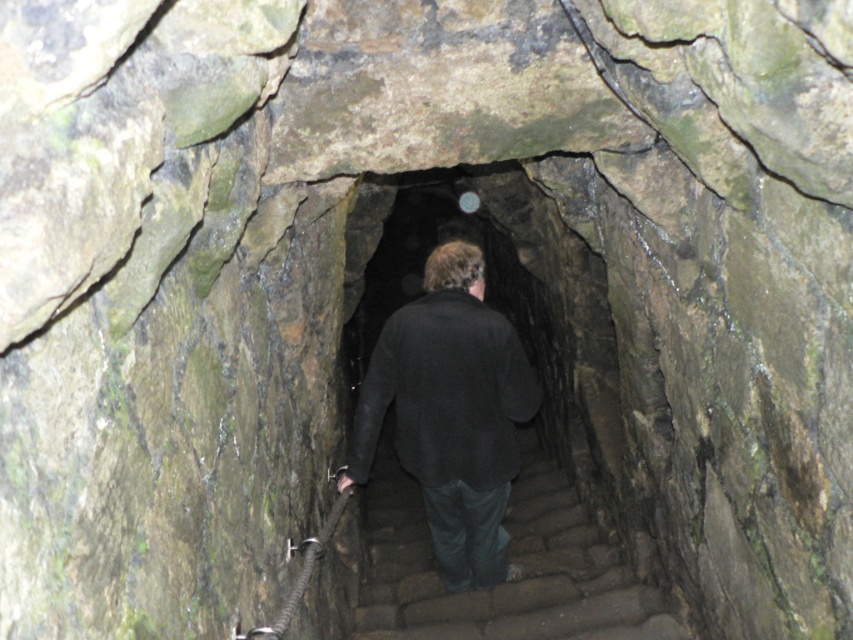
You are a tour guide leading a group through this historical tunnel. You notice the black matte jacket at center and the brown stone stairs at center. Which object takes up more space in the image?

The brown stone stairs at center takes up more space in the image than the black matte jacket at center because the black matte jacket at center occupies less space than brown stone stairs at center.

You are standing at the entrance of the tunnel and see the black matte jacket at center and the brown stone stairs at center. Which object is closer to you?

The black matte jacket at center is closer to you because it is located above the brown stone stairs at center, meaning it is positioned nearer in the tunnel.

You are standing in the tunnel and see the black matte jacket at center and the brown stone stairs at center. Which object is closer to you?

The black matte jacket at center is closer to you because the brown stone stairs at center are positioned behind it.